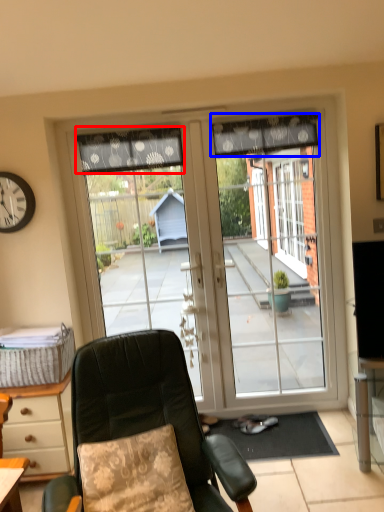
Question: Which of the following is the farthest to the observer, curtain (highlighted by a red box) or curtain (highlighted by a blue box)?

Choices:
 (A) curtain
 (B) curtain

Answer: (A)